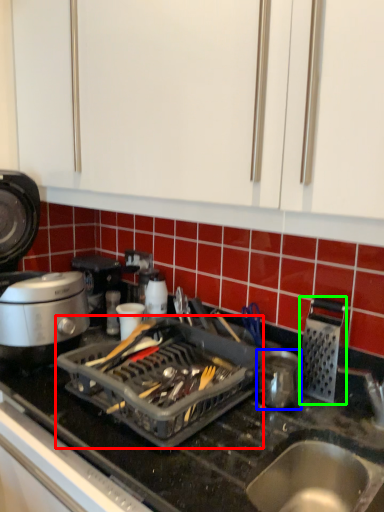
Question: Based on their relative distances, which object is nearer to appliance (highlighted by a red box)? Choose from kitchen appliance (highlighted by a blue box) and kitchen appliance (highlighted by a green box).

Choices:
 (A) kitchen appliance
 (B) kitchen appliance

Answer: (A)